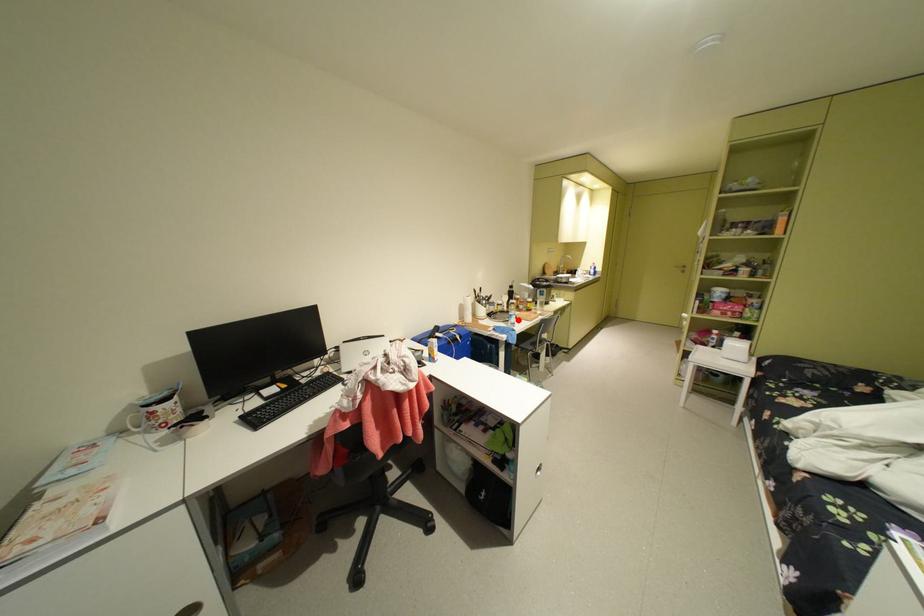
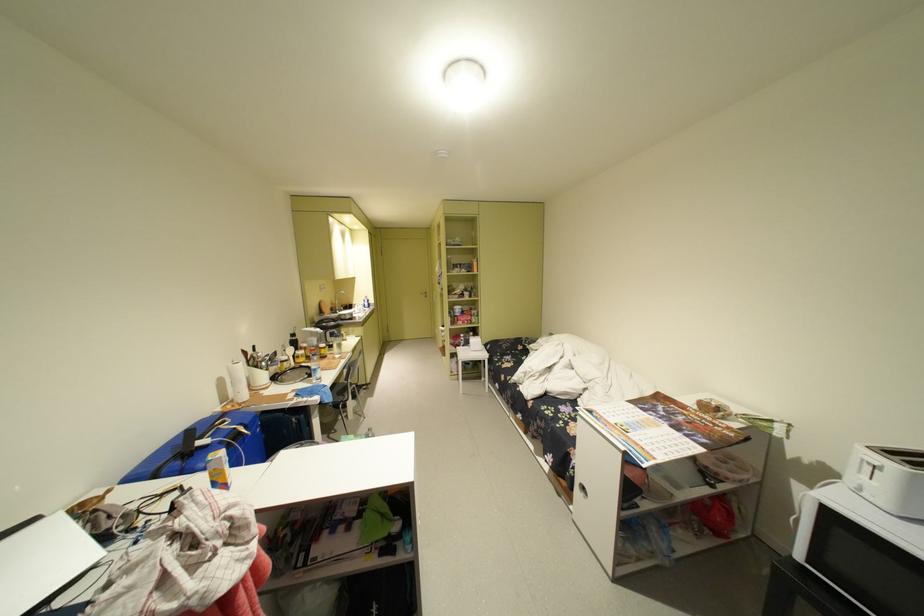
Find the pixel in the second image that matches the highlighted location in the first image.

(318, 377)